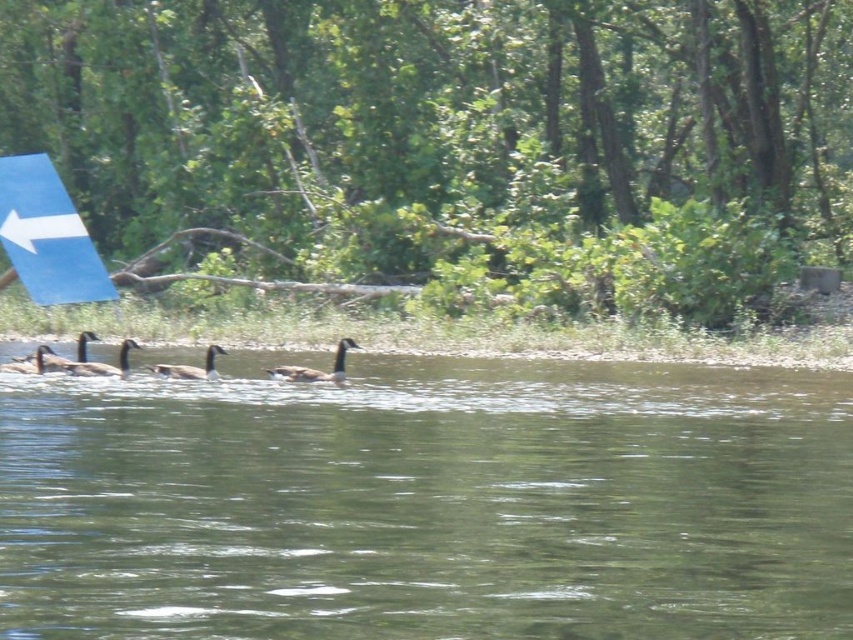
Who is more forward, (131,524) or (215,371)?

Point (131,524)

Locate an element on the screen. The width and height of the screenshot is (853, 640). green smooth water at center is located at coordinates (428, 502).

Between point (93, 465) and point (212, 380), which one is positioned behind?

Positioned behind is point (212, 380).

You are a GUI agent. You are given a task and a screenshot of the screen. Output one action in this format:
    pyautogui.click(x=<x>, y=<y>)
    Task: Click on the green smooth water at center
    This screenshot has width=853, height=640.
    Given the screenshot: What is the action you would take?
    pyautogui.click(x=428, y=502)

Which is below, dark brown duck at center or brown feathered duck at lower left?

Positioned lower is dark brown duck at center.

At what (x,y) coordinates should I click in order to perform the action: click on dark brown duck at center. Please return your answer as a coordinate pair (x, y). The height and width of the screenshot is (640, 853). Looking at the image, I should click on (315, 369).

Identify the location of dark brown duck at center. The height and width of the screenshot is (640, 853). (315, 369).

What do you see at coordinates (103, 364) in the screenshot? The image size is (853, 640). I see `brown matte duck at center` at bounding box center [103, 364].

Is brown matte duck at center above brown feathered duck at center?

Yes.

The image size is (853, 640). Describe the element at coordinates (103, 364) in the screenshot. I see `brown matte duck at center` at that location.

Where is `brown matte duck at center`? The width and height of the screenshot is (853, 640). brown matte duck at center is located at coordinates (103, 364).